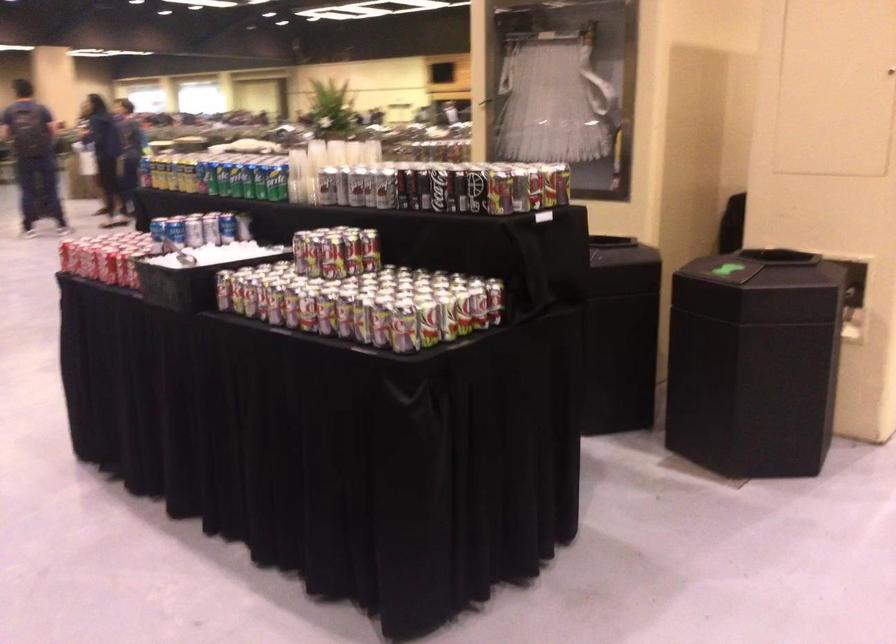
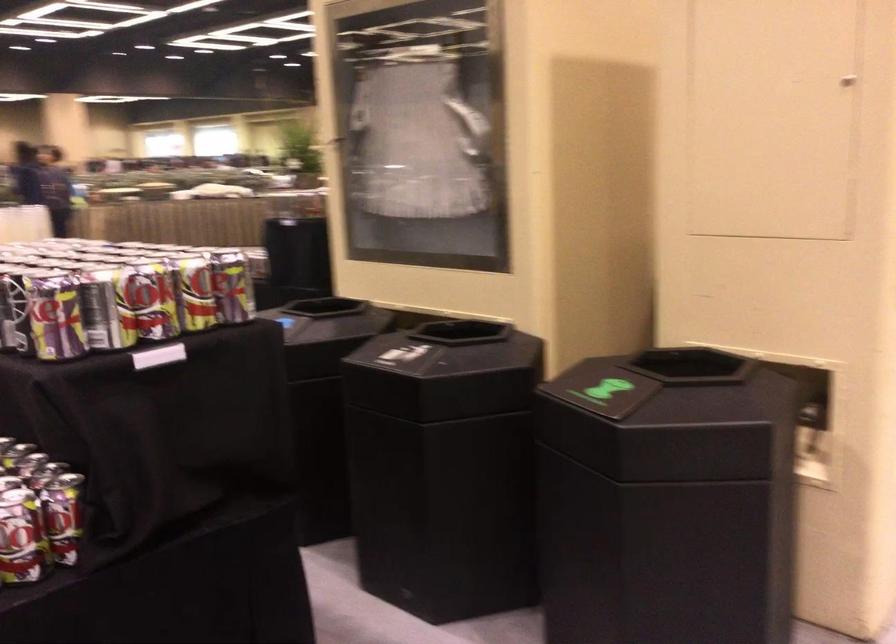
Consider the image. The images are taken continuously from a first-person perspective. In which direction are you moving?

The cameraman moved toward right, forward.